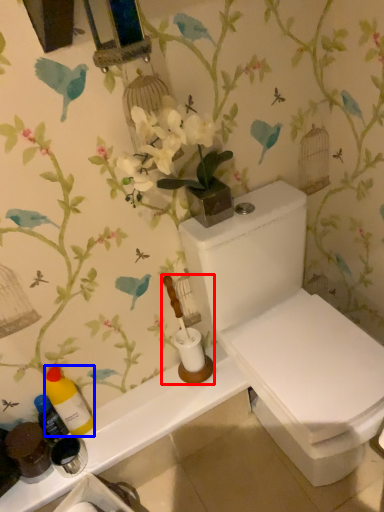
Question: Which point is further to the camera, toiletries (highlighted by a red box) or bottle (highlighted by a blue box)?

Choices:
 (A) toiletries
 (B) bottle

Answer: (B)